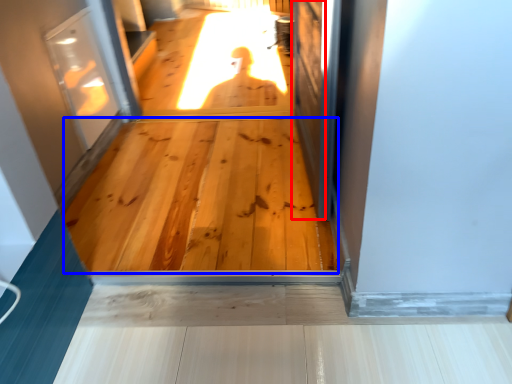
Question: Which of the following is the closest to the observer, screen door (highlighted by a red box) or hardwood (highlighted by a blue box)?

Choices:
 (A) screen door
 (B) hardwood

Answer: (A)